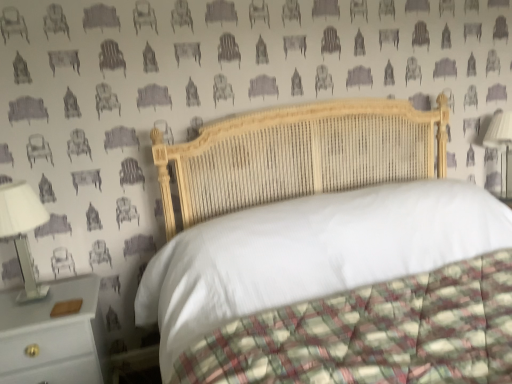
Question: Is wooden bed at center thinner than white wood nightstand at lower left?

Choices:
 (A) yes
 (B) no

Answer: (B)

Question: Is wooden bed at center not inside white wood nightstand at lower left?

Choices:
 (A) yes
 (B) no

Answer: (A)

Question: Is wooden bed at center at the left side of white wood nightstand at lower left?

Choices:
 (A) no
 (B) yes

Answer: (A)

Question: Could you tell me if wooden bed at center is turned towards white wood nightstand at lower left?

Choices:
 (A) yes
 (B) no

Answer: (B)

Question: From a real-world perspective, is wooden bed at center physically above white wood nightstand at lower left?

Choices:
 (A) no
 (B) yes

Answer: (B)

Question: Is wooden bed at center wider or thinner than white glossy bedside lamp at left, which appears as the 2th bedside lamp when viewed from the top?

Choices:
 (A) thin
 (B) wide

Answer: (B)

Question: Based on their positions, is wooden bed at center located to the left or right of white glossy bedside lamp at left, which is the 1th bedside lamp in left-to-right order?

Choices:
 (A) right
 (B) left

Answer: (A)

Question: In the image, is wooden bed at center positioned in front of or behind white glossy bedside lamp at left, which is the 2th bedside lamp in back-to-front order?

Choices:
 (A) front
 (B) behind

Answer: (A)

Question: From the image's perspective, relative to white glossy bedside lamp at left, which is the 2th bedside lamp in back-to-front order, is wooden bed at center above or below?

Choices:
 (A) above
 (B) below

Answer: (B)

Question: In terms of height, does white fabric lampshade at right, which is the first bedside lamp from back to front, look taller or shorter compared to wooden bed at center?

Choices:
 (A) tall
 (B) short

Answer: (B)

Question: From a real-world perspective, is white fabric lampshade at right, marked as the first bedside lamp in a top-to-bottom arrangement, physically located above or below wooden bed at center?

Choices:
 (A) below
 (B) above

Answer: (B)

Question: Is white fabric lampshade at right, marked as the second bedside lamp in a left-to-right arrangement, in front of or behind wooden bed at center in the image?

Choices:
 (A) behind
 (B) front

Answer: (A)

Question: From the image's perspective, is white fabric lampshade at right, the 2th bedside lamp in the front-to-back sequence, positioned above or below wooden bed at center?

Choices:
 (A) above
 (B) below

Answer: (A)

Question: Is white glossy bedside lamp at left, arranged as the first bedside lamp when viewed from the front, wider or thinner than white wood nightstand at lower left?

Choices:
 (A) thin
 (B) wide

Answer: (A)

Question: Relative to white wood nightstand at lower left, is white glossy bedside lamp at left, which appears as the 2th bedside lamp when viewed from the right, in front or behind?

Choices:
 (A) front
 (B) behind

Answer: (B)